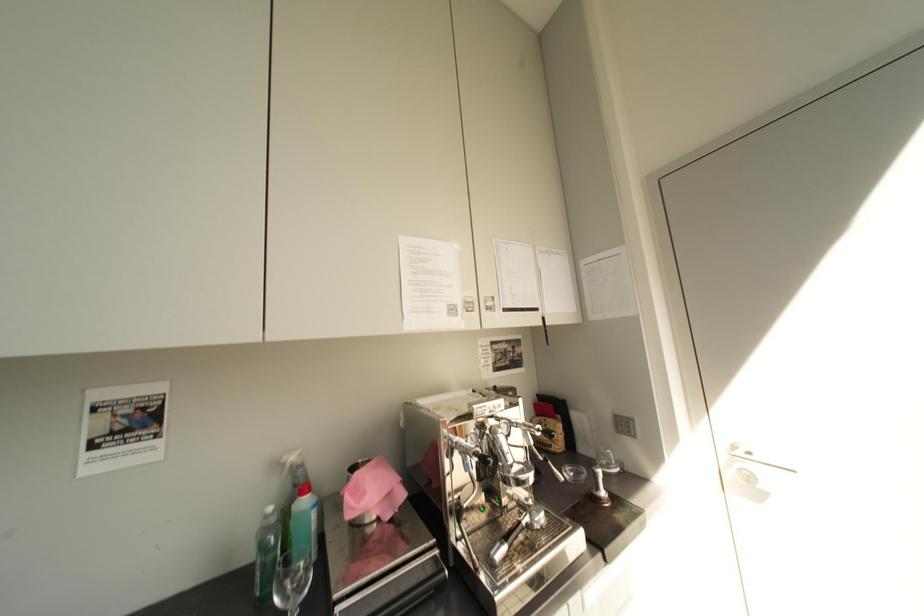
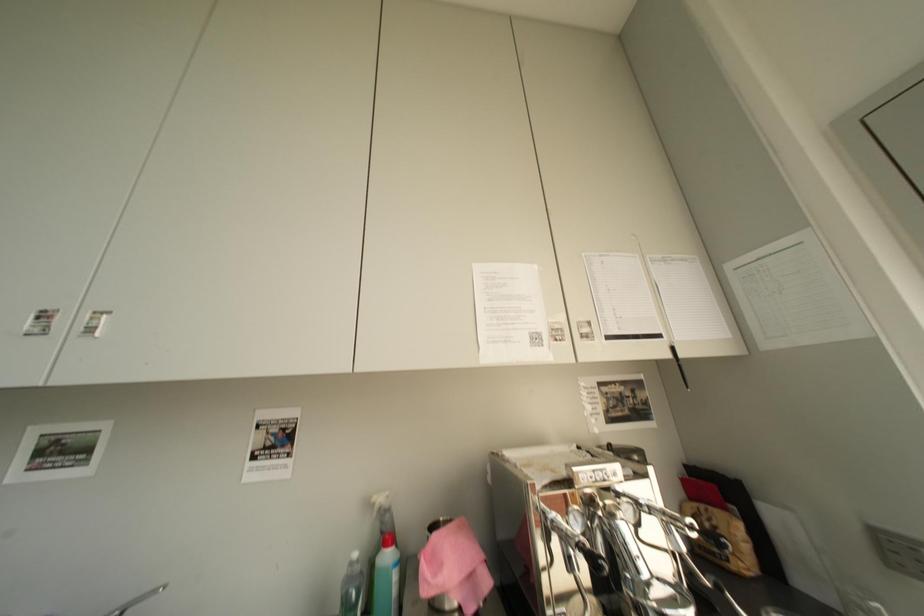
Looking at this image, what movement of the cameraman would produce the second image?

The movement direction of the cameraman is right, forward.